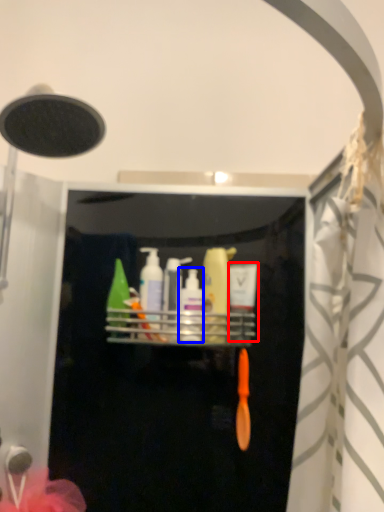
Question: Which point is further to the camera, toiletry (highlighted by a red box) or toiletry (highlighted by a blue box)?

Choices:
 (A) toiletry
 (B) toiletry

Answer: (A)